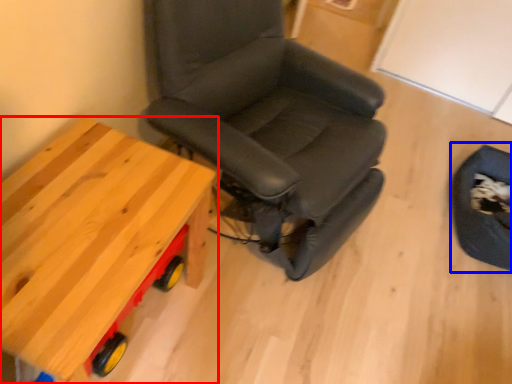
Question: Which object appears farthest to the camera in this image, table (highlighted by a red box) or swivel chair (highlighted by a blue box)?

Choices:
 (A) table
 (B) swivel chair

Answer: (B)